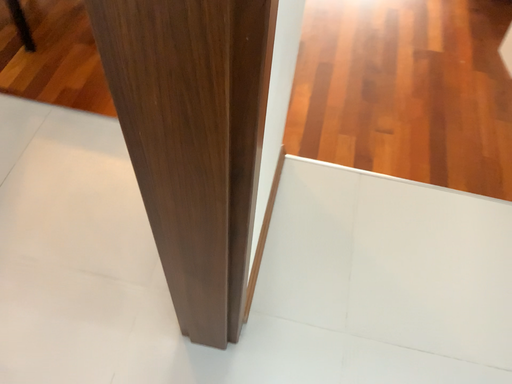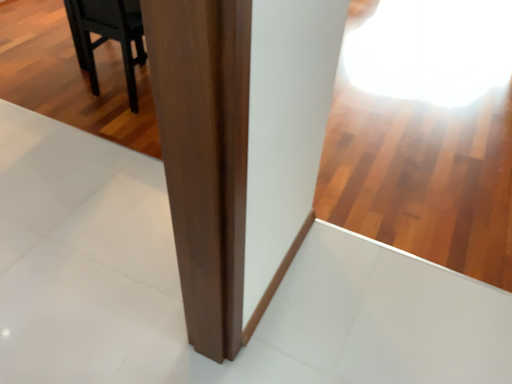
Question: How did the camera likely rotate when shooting the video?

Choices:
 (A) rotated upward
 (B) rotated downward

Answer: (A)